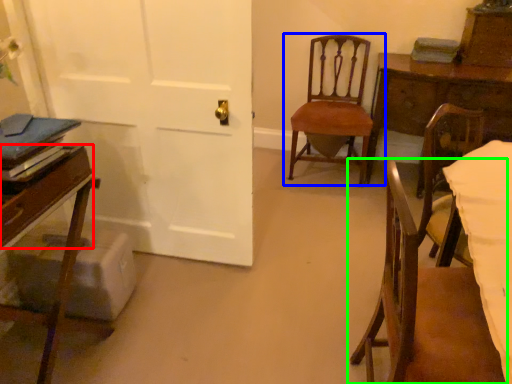
Question: Based on their relative distances, which object is farther from drawer (highlighted by a red box)? Choose from chair (highlighted by a blue box) and chair (highlighted by a green box).

Choices:
 (A) chair
 (B) chair

Answer: (A)